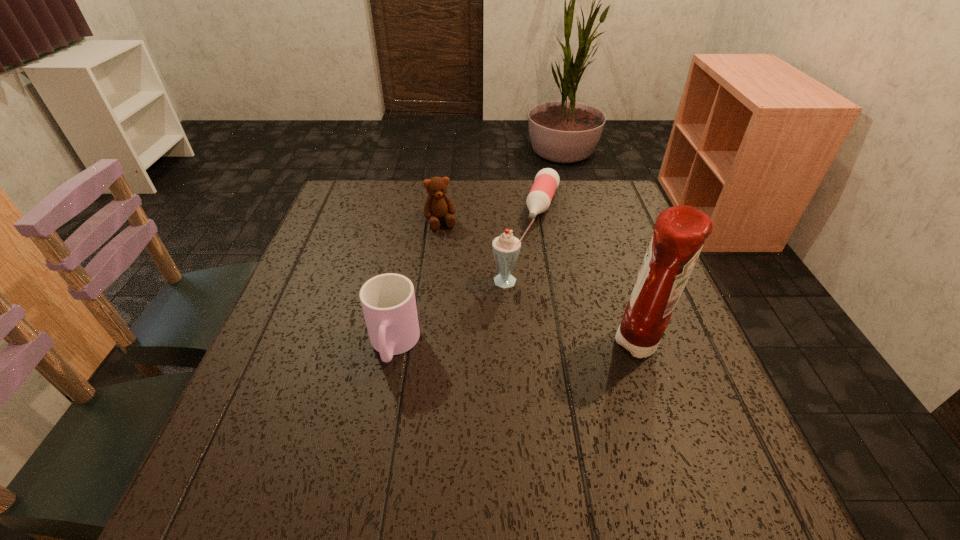
Where is `vacant region located with the cap open on the fourth object from left to right`? vacant region located with the cap open on the fourth object from left to right is located at coordinates (534, 248).

Where is `free space located with the cap open on the fourth object from left to right`? Image resolution: width=960 pixels, height=540 pixels. free space located with the cap open on the fourth object from left to right is located at coordinates (529, 260).

Locate an element on the screen. This screenshot has width=960, height=540. free space located with the cap open on the fourth object from left to right is located at coordinates (507, 319).

The width and height of the screenshot is (960, 540). I want to click on free spot located on the face of the teddy bear, so click(479, 331).

Locate an element on the screen. Image resolution: width=960 pixels, height=540 pixels. vacant region located 0.370m on the face of the teddy bear is located at coordinates 479,331.

Identify the location of vacant space located on the face of the teddy bear. The height and width of the screenshot is (540, 960). (474, 318).

Identify the location of free space located on the straw side of the third nearest object. (468, 397).

Identify the location of vacant space situated 0.230m on the straw side of the third nearest object. Image resolution: width=960 pixels, height=540 pixels. (478, 367).

This screenshot has height=540, width=960. Identify the location of free point located 0.180m on the straw side of the third nearest object. (485, 348).

Identify the location of bottle at the far edge. The image size is (960, 540). (547, 180).